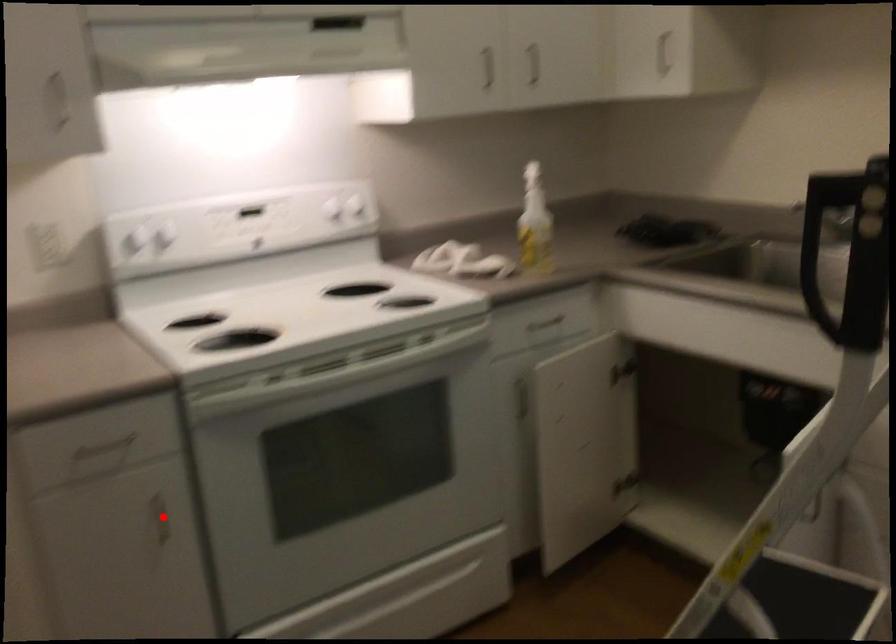
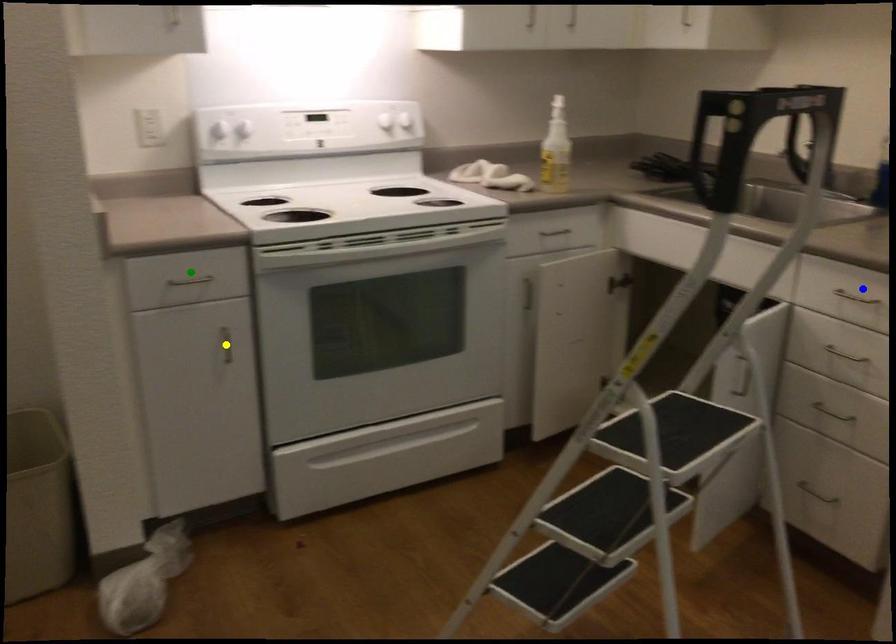
Question: I am providing you with two images of the same scene from different viewpoints. A red point is marked on the first image. You are given multiple points on the second image. Can you choose the point in image 2 that corresponds to the point in image 1?

Choices:
 (A) green point
 (B) yellow point
 (C) blue point

Answer: (B)